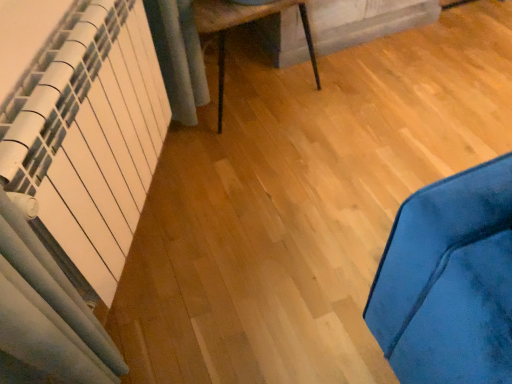
Question: Looking at their shapes, would you say wooden table at center is wider or thinner than white matte radiator at left?

Choices:
 (A) wide
 (B) thin

Answer: (A)

Question: Relative to white matte radiator at left, is wooden table at center in front or behind?

Choices:
 (A) behind
 (B) front

Answer: (A)

Question: Is wooden table at center bigger or smaller than white matte radiator at left?

Choices:
 (A) big
 (B) small

Answer: (A)

Question: Does point (44, 175) appear closer or farther from the camera than point (205, 29)?

Choices:
 (A) closer
 (B) farther

Answer: (A)

Question: In the image, is white matte radiator at left on the left side or the right side of wooden table at center?

Choices:
 (A) left
 (B) right

Answer: (A)

Question: Is white matte radiator at left taller or shorter than wooden table at center?

Choices:
 (A) tall
 (B) short

Answer: (A)

Question: From the image's perspective, relative to wooden table at center, is white matte radiator at left above or below?

Choices:
 (A) below
 (B) above

Answer: (A)